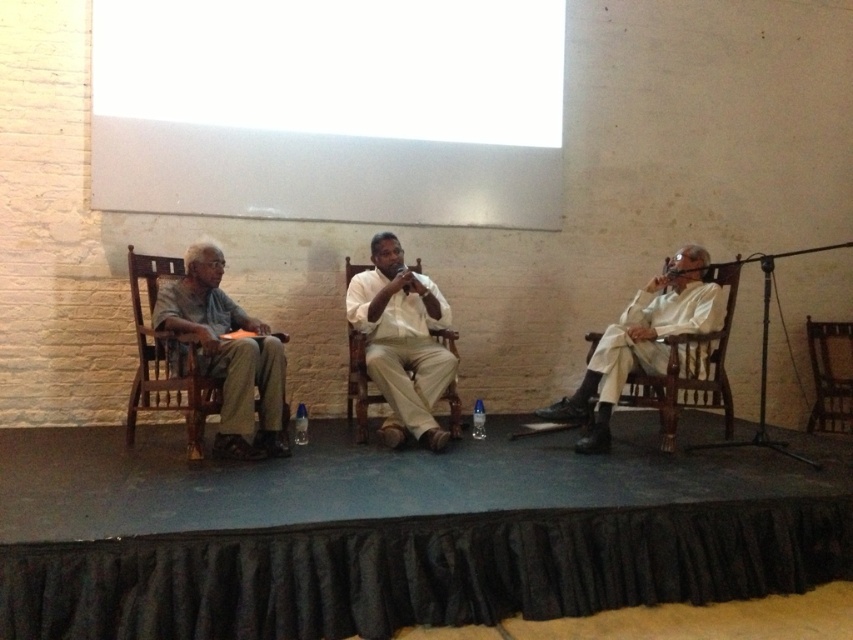
Based on the photo, you are a stagehand setting up for a play. You need to position a camera so that it is exactly 3.53 meters away from the wooden chair at left. Where should you place the camera?

The camera should be placed 3.53 meters away from the wooden chair at left to meet the requirement.

You are an actor standing on the stage floor. You need to move from your current position to the wooden chair at left and then to the wooden at right. Which chair will require you to climb up to reach it?

The wooden chair at left is located above the wooden at right, so you will need to climb up to reach the wooden chair at left.

You are a stagehand who needs to move a 3.5 meter long curtain rod from the storage room to the stage. The rod must be placed horizontally between the wooden chair at left and the wooden at center. Can you fit the rod between them without bending it?

The distance between the wooden chair at left and the wooden at center is 4.57 meters. Since the curtain rod is 3.5 meters long, it can be placed horizontally between them without bending as there is enough space.